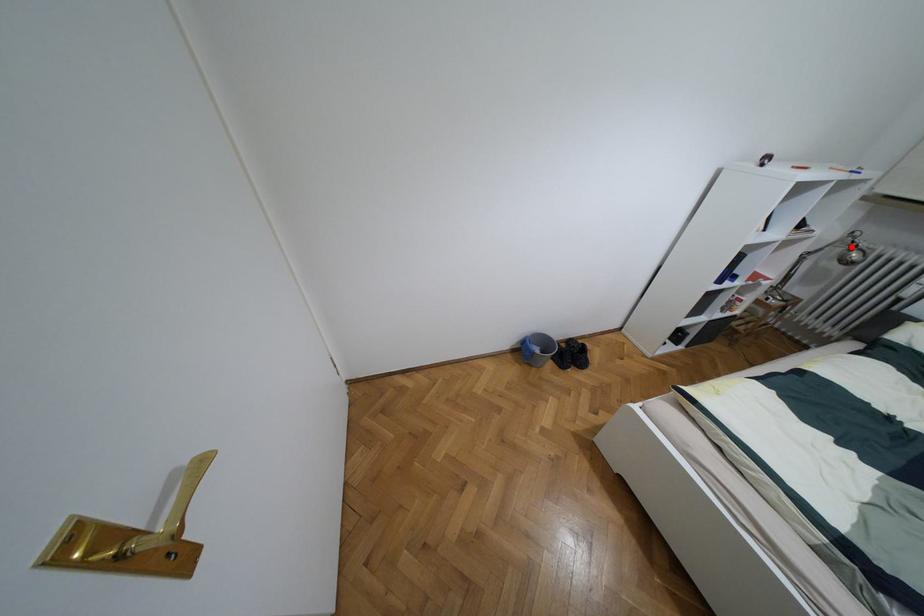
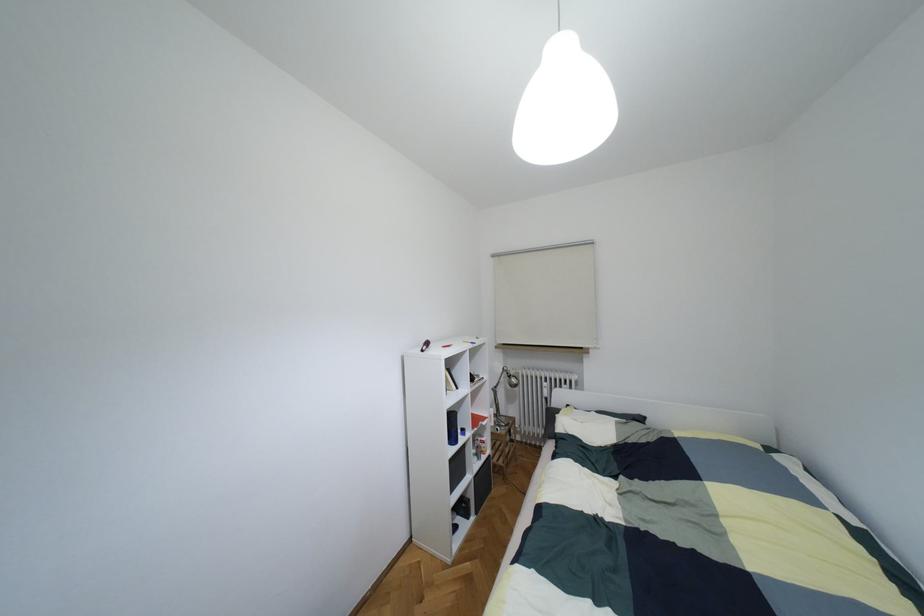
Question: I am providing you with two images of the same scene from different viewpoints. Given a red point in image1, look at the same physical point in image2. Is it:

Choices:
 (A) Closer to the viewpoint
 (B) Farther from the viewpoint

Answer: (A)